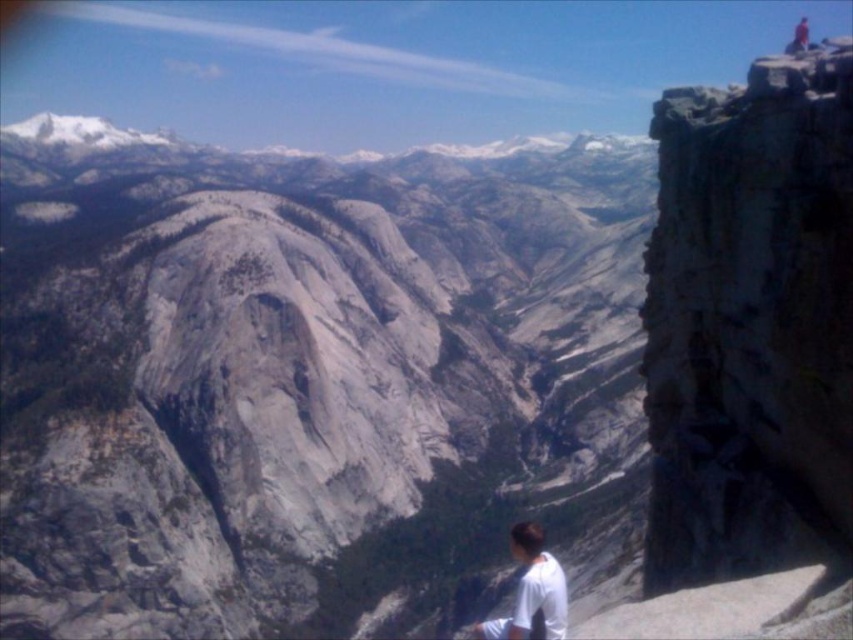
Is gray rock formation at center further to the viewer compared to white matte shirt at lower right?

Yes, gray rock formation at center is behind white matte shirt at lower right.

Who is higher up, gray rock formation at center or white matte shirt at lower right?

Positioned higher is gray rock formation at center.

Which is behind, point (521, 403) or point (492, 627)?

The point (521, 403) is behind.

Locate an element on the screen. The height and width of the screenshot is (640, 853). gray rock formation at center is located at coordinates (308, 380).